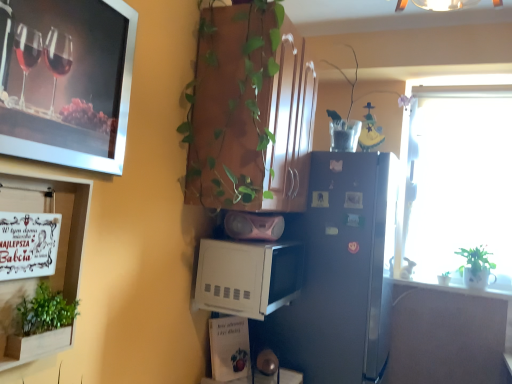
At what (x,y) coordinates should I click in order to perform the action: click on vacant area that is in front of pink matte speaker at center, positioned as the 2th appliance in bottom-to-top order. Please return your answer as a coordinate pair (x, y). This screenshot has height=384, width=512. Looking at the image, I should click on (255, 244).